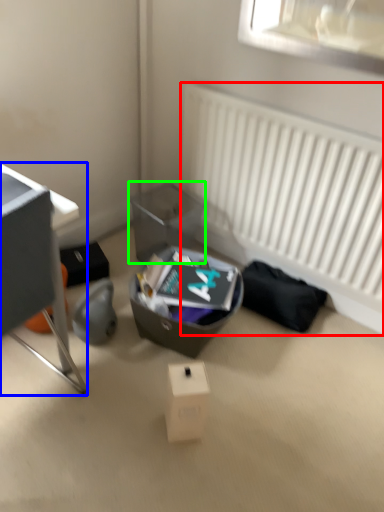
Question: Considering the real-world distances, which object is closest to radiator (highlighted by a red box)? desk (highlighted by a blue box) or shoe box (highlighted by a green box).

Choices:
 (A) desk
 (B) shoe box

Answer: (B)